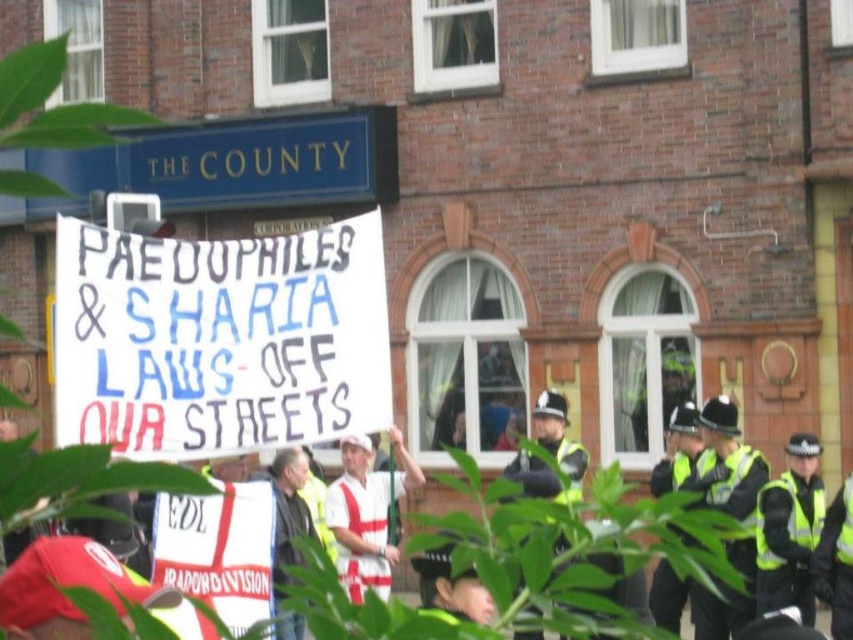
Question: Which is nearer to the white fabric shirt at center?

Choices:
 (A) dark gray jacket at center
 (B) high-visibility yellow jacket at right

Answer: (A)

Question: Is white fabric shirt at center to the left of dark gray jacket at center from the viewer's perspective?

Choices:
 (A) yes
 (B) no

Answer: (B)

Question: Does high-visibility yellow jacket at right appear on the right side of dark gray jacket at center?

Choices:
 (A) yes
 (B) no

Answer: (A)

Question: Can you confirm if high-visibility yellow jacket at right is positioned to the left of white fabric shirt at center?

Choices:
 (A) no
 (B) yes

Answer: (A)

Question: Among these objects, which one is farthest from the camera?

Choices:
 (A) high-visibility yellow jacket at right
 (B) white fabric shirt at center

Answer: (A)

Question: Considering the real-world distances, which object is closest to the white fabric shirt at center?

Choices:
 (A) dark gray jacket at center
 (B) high-visibility yellow jacket at right

Answer: (A)